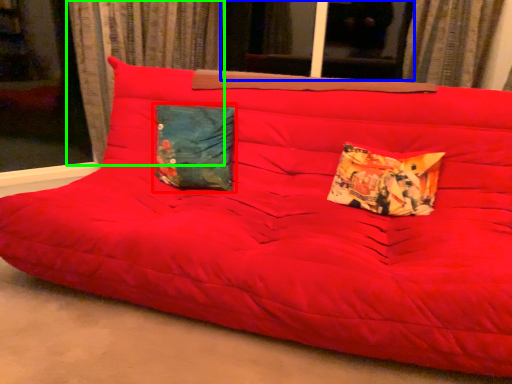
Question: Which object is positioned closest to pillow (highlighted by a red box)? Select from window (highlighted by a blue box) and curtain (highlighted by a green box).

Choices:
 (A) window
 (B) curtain

Answer: (B)